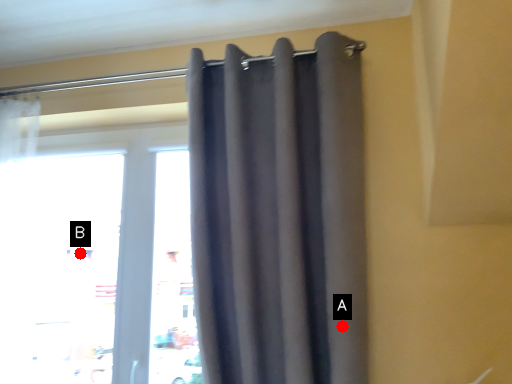
Question: Two points are circled on the image, labeled by A and B beside each circle. Which of the following is the farthest from the observer?

Choices:
 (A) A is further
 (B) B is further

Answer: (B)